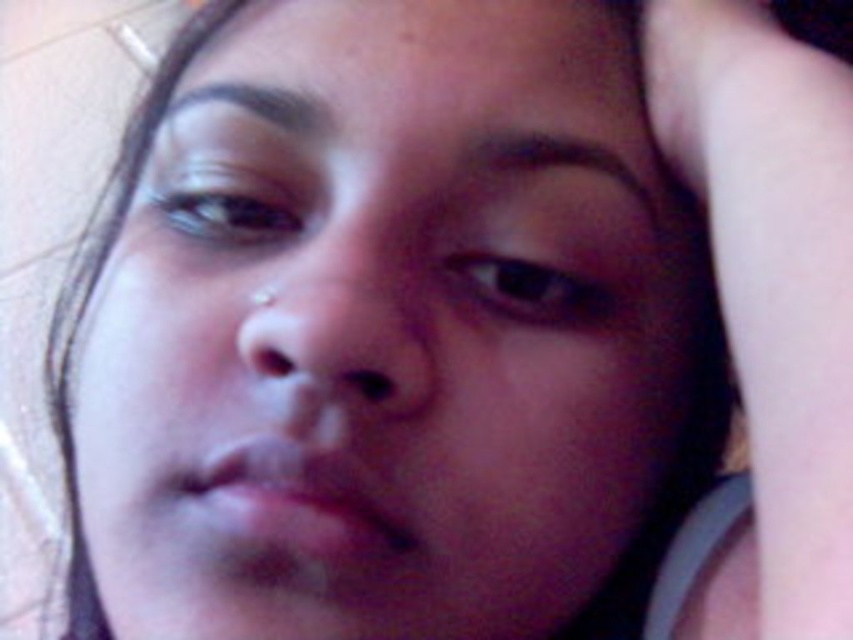
Is pale skin arm at right below brown matte eye at center?

No, pale skin arm at right is not below brown matte eye at center.

Which is more to the left, pale skin arm at right or brown matte eye at center?

From the viewer's perspective, brown matte eye at center appears more on the left side.

What are the coordinates of `pale skin arm at right` in the screenshot? It's located at (775, 275).

Which is more to the left, pale skin arm at right or brown matte eye at upper left?

brown matte eye at upper left is more to the left.

Which of these two, pale skin arm at right or brown matte eye at upper left, stands taller?

pale skin arm at right

Between point (848, 346) and point (241, 179), which one is positioned in front?

Positioned in front is point (848, 346).

Where is `pale skin arm at right`? Image resolution: width=853 pixels, height=640 pixels. pale skin arm at right is located at coordinates (775, 275).

Between point (196, 163) and point (488, 282), which one is positioned in front?

Point (488, 282) is in front.

Is point (192, 156) positioned behind point (555, 301)?

Yes, it is.

The height and width of the screenshot is (640, 853). I want to click on brown matte eye at upper left, so click(x=225, y=202).